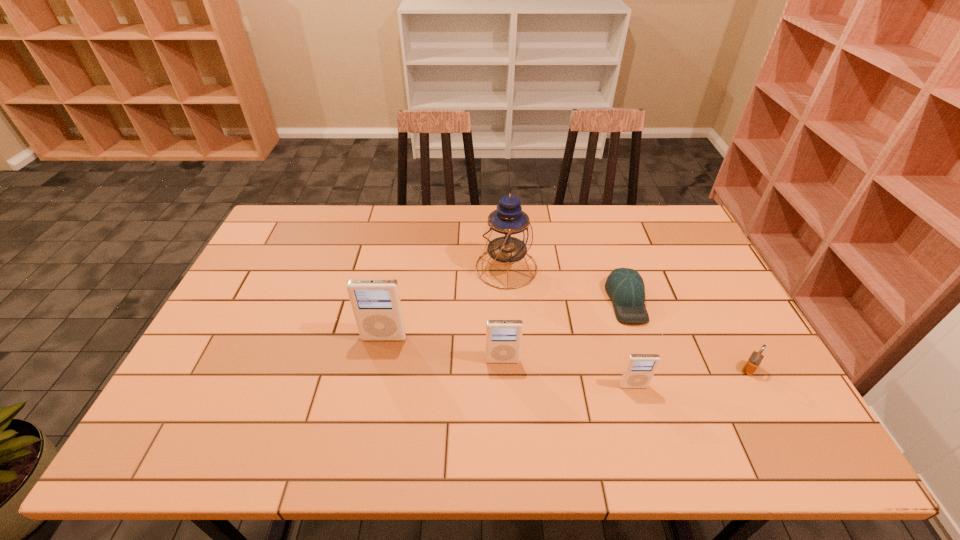
I want to click on free point between the shortest object and the fourth tallest object, so click(630, 343).

Locate an element on the screen. The width and height of the screenshot is (960, 540). free spot between the fifth tallest object and the second farthest iPod is located at coordinates (626, 365).

Find the location of a particular element. The height and width of the screenshot is (540, 960). free spot between the fifth tallest object and the rightmost iPod is located at coordinates (691, 377).

Where is `empty space between the second tallest iPod and the baseball cap`? Image resolution: width=960 pixels, height=540 pixels. empty space between the second tallest iPod and the baseball cap is located at coordinates (564, 330).

This screenshot has height=540, width=960. What are the coordinates of `the fifth closest object to the nearest object` in the screenshot? It's located at (376, 303).

Select which object appears as the third closest to the second iPod from right to left. Please provide its 2D coordinates. Your answer should be formatted as a tuple, i.e. [(x, y)], where the tuple contains the x and y coordinates of a point satisfying the conditions above.

[(508, 234)]

Select which iPod is the second closest to the fourth tallest object. Please provide its 2D coordinates. Your answer should be formatted as a tuple, i.e. [(x, y)], where the tuple contains the x and y coordinates of a point satisfying the conditions above.

[(376, 303)]

Locate which iPod is the closest to the rightmost iPod. Please provide its 2D coordinates. Your answer should be formatted as a tuple, i.e. [(x, y)], where the tuple contains the x and y coordinates of a point satisfying the conditions above.

[(503, 337)]

Locate an element on the screen. free location that satisfies the following two spatial constraints: 1. on the front-facing side of the lantern; 2. on the right side of the second shortest object is located at coordinates (513, 369).

At what (x,y) coordinates should I click in order to perform the action: click on free point that satisfies the following two spatial constraints: 1. on the front-facing side of the lantern; 2. on the front-facing side of the second nearest iPod. Please return your answer as a coordinate pair (x, y). Looking at the image, I should click on (512, 361).